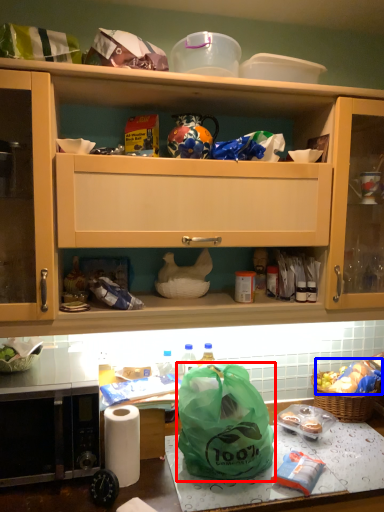
Question: Among these objects, which one is farthest to the camera, plastic bag (highlighted by a red box) or food (highlighted by a blue box)?

Choices:
 (A) plastic bag
 (B) food

Answer: (B)